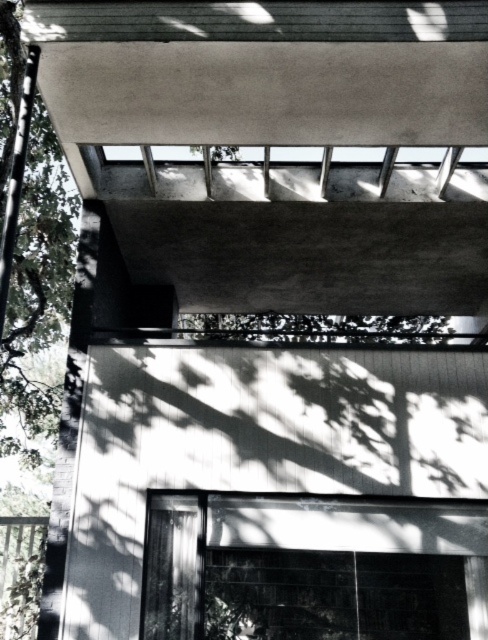
Question: Is green leafy tree at left above green leafy tree at center?

Choices:
 (A) no
 (B) yes

Answer: (A)

Question: Which of the following is the closest to the observer?

Choices:
 (A) (326, 330)
 (B) (4, 445)

Answer: (A)

Question: Is green leafy tree at left below green leafy tree at center?

Choices:
 (A) yes
 (B) no

Answer: (A)

Question: Can you confirm if green leafy tree at left is wider than green leafy tree at center?

Choices:
 (A) yes
 (B) no

Answer: (A)